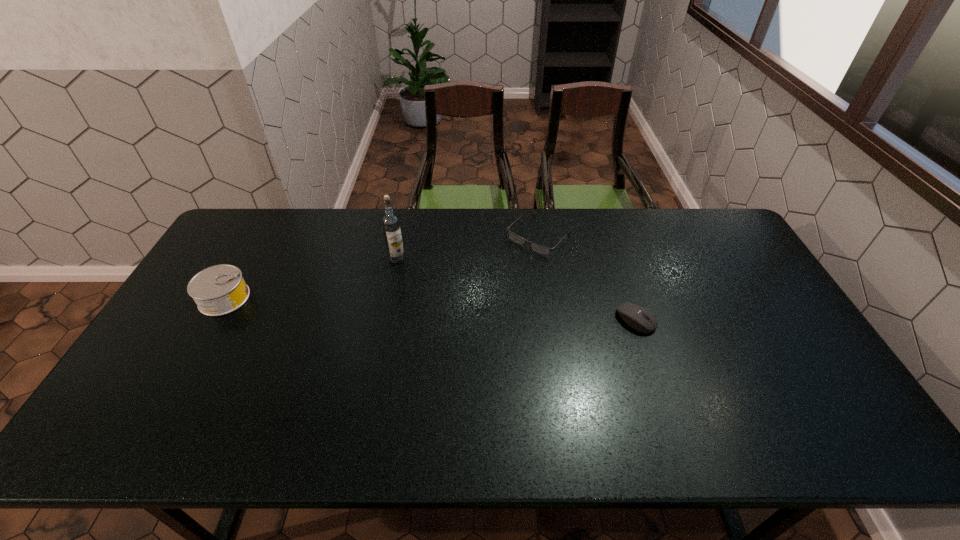
Locate an element on the screen. The width and height of the screenshot is (960, 540). vacant area at the far right corner is located at coordinates click(705, 248).

Identify the location of empty space that is in between the rightmost object and the second tallest object. The image size is (960, 540). (430, 309).

Find the location of a particular element. This screenshot has height=540, width=960. vacant region between the tallest object and the computer equipment is located at coordinates (516, 289).

Where is `empty space that is in between the third object from right to left and the computer equipment`? Image resolution: width=960 pixels, height=540 pixels. empty space that is in between the third object from right to left and the computer equipment is located at coordinates (516, 289).

Where is `unoccupied area between the third object from right to left and the rightmost object`? The height and width of the screenshot is (540, 960). unoccupied area between the third object from right to left and the rightmost object is located at coordinates (516, 289).

At what (x,y) coordinates should I click in order to perform the action: click on empty location between the leftmost object and the rightmost object. Please return your answer as a coordinate pair (x, y). This screenshot has height=540, width=960. Looking at the image, I should click on (430, 309).

At what (x,y) coordinates should I click in order to perform the action: click on vacant area that lies between the computer equipment and the vodka. Please return your answer as a coordinate pair (x, y). Image resolution: width=960 pixels, height=540 pixels. Looking at the image, I should click on (516, 289).

The width and height of the screenshot is (960, 540). In order to click on free spot between the vodka and the leftmost object in this screenshot , I will do `click(311, 279)`.

Where is `free point between the spectacles and the leftmost object`? The image size is (960, 540). free point between the spectacles and the leftmost object is located at coordinates (382, 267).

Locate an element on the screen. The height and width of the screenshot is (540, 960). vacant area between the can and the spectacles is located at coordinates (382, 267).